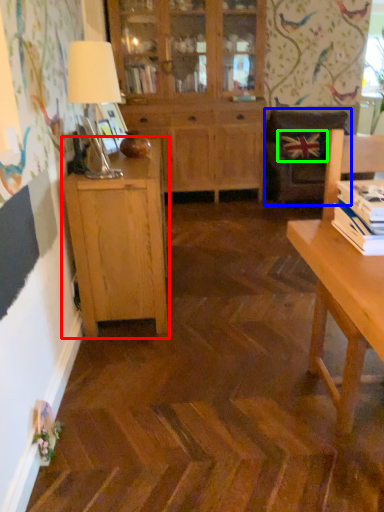
Question: Considering the real-world distances, which object is closest to cabinetry (highlighted by a red box)? chair (highlighted by a blue box) or pillow (highlighted by a green box).

Choices:
 (A) chair
 (B) pillow

Answer: (A)